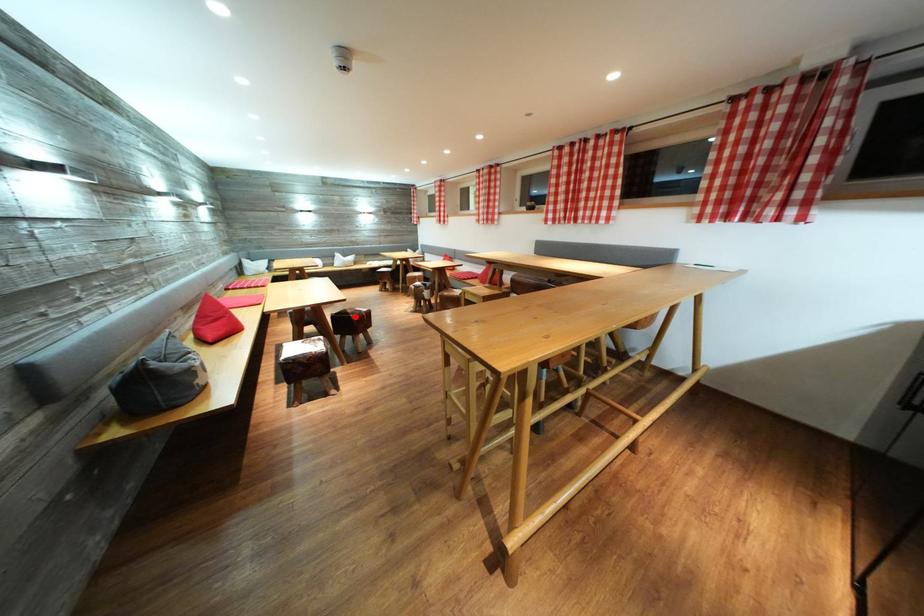
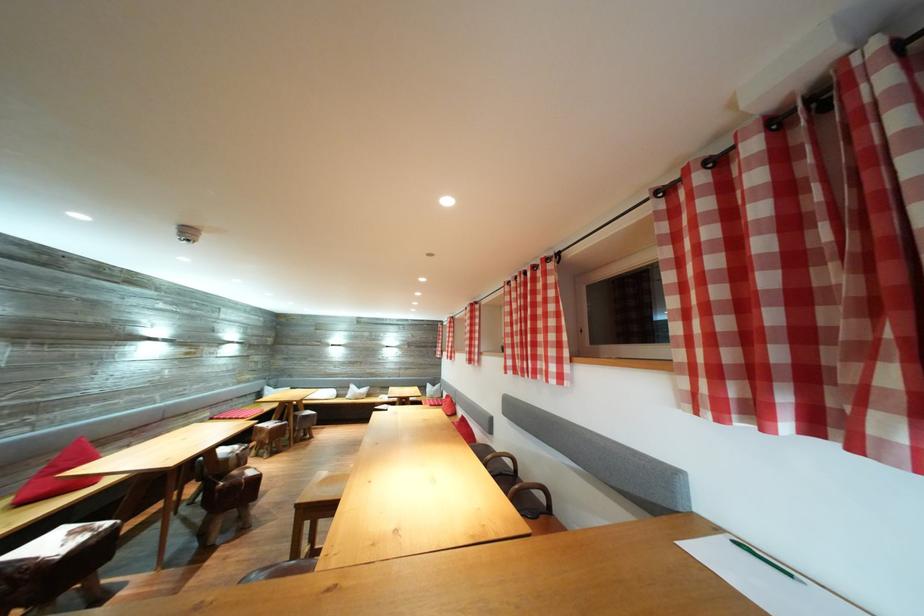
The point at the highlighted location is marked in the first image. Where is the corresponding point in the second image?

(241, 477)